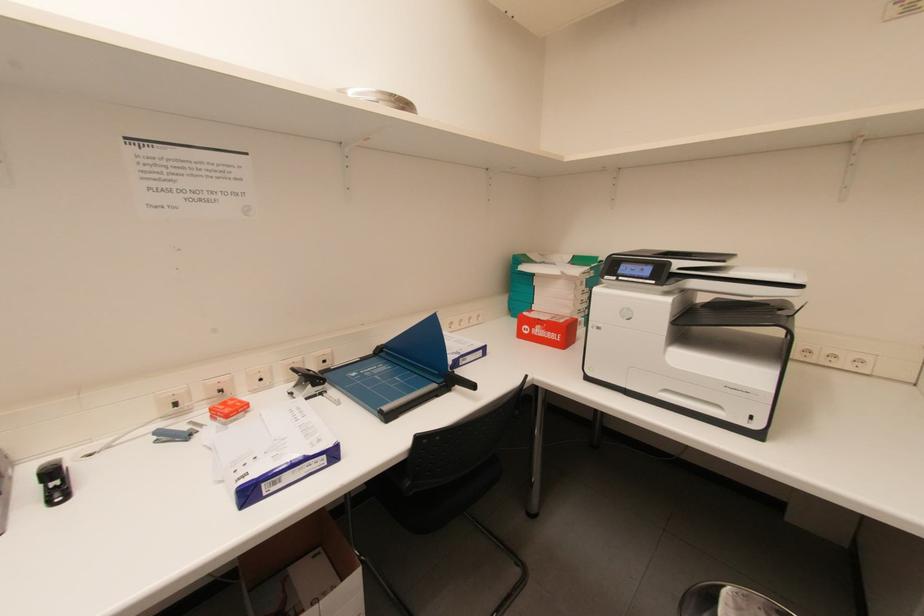
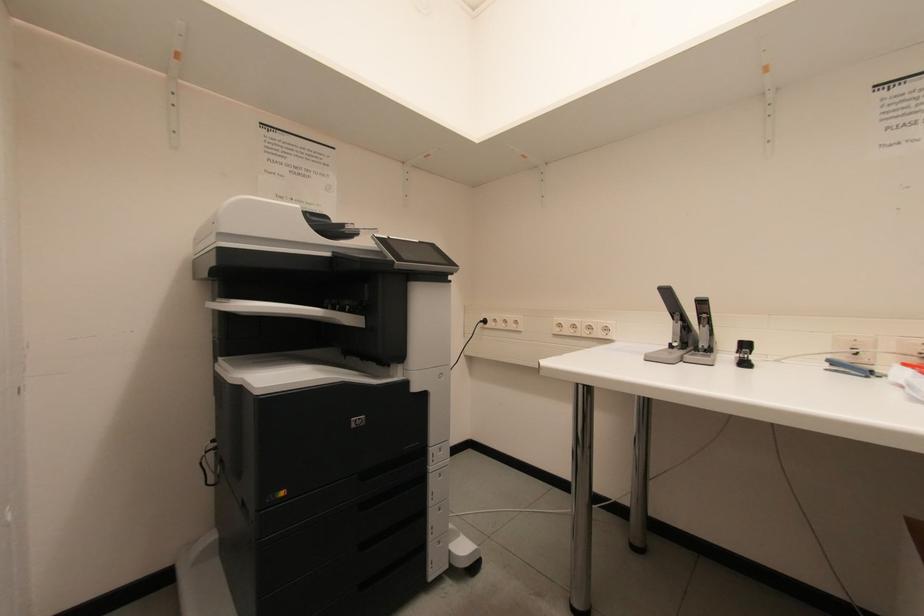
Question: The images are taken continuously from a first-person perspective. In which direction is your viewpoint rotating?

Choices:
 (A) Left
 (B) Right
 (C) Up
 (D) Down

Answer: (A)